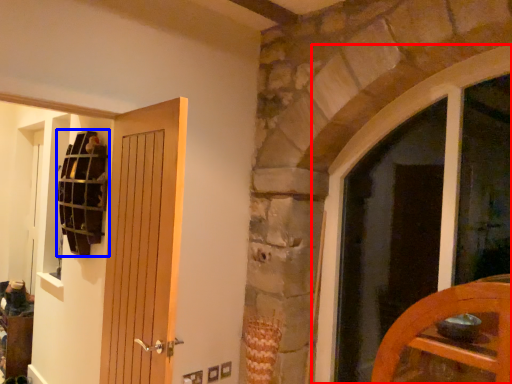
Question: Which point is closer to the camera, window (highlighted by a red box) or shelf (highlighted by a blue box)?

Choices:
 (A) window
 (B) shelf

Answer: (A)